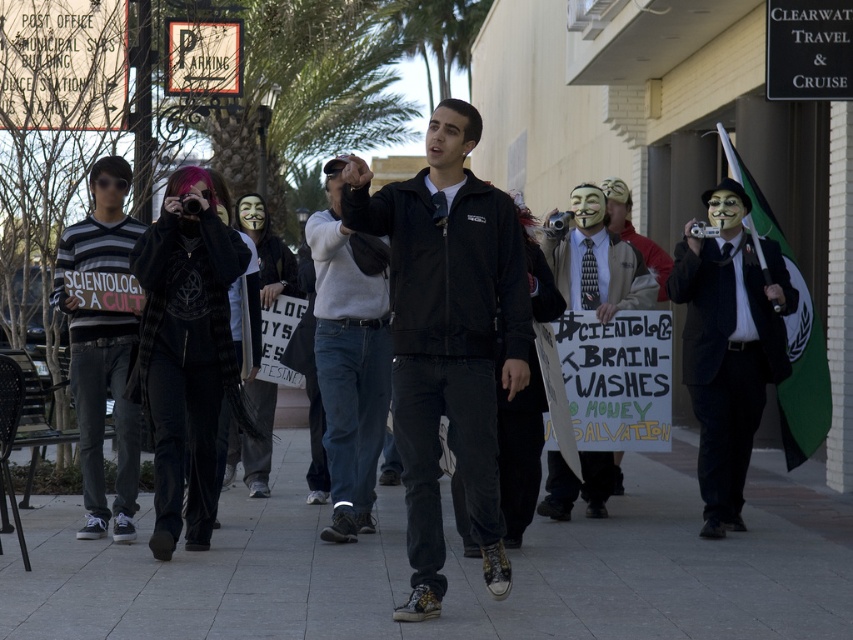
You are a photographer trying to capture a clear shot of the matte black suit at right and the green fabric flag at right. Based on their positions, which object would appear closer to the bottom of the photo?

The matte black suit at right is below the green fabric flag at right, so it would appear closer to the bottom of the photo.

You are a photographer trying to capture the protest scene. You want to ensure both the dark gray sweater at center and the green fabric flag at right are clearly visible in your photo. Given their sizes, which object should you focus on to ensure it remains in frame without needing to adjust your camera angle?

The dark gray sweater at center is larger in size than the green fabric flag at right, so focusing on the dark gray sweater at center would ensure it stays in frame without needing adjustments, as it occupies more visual space.